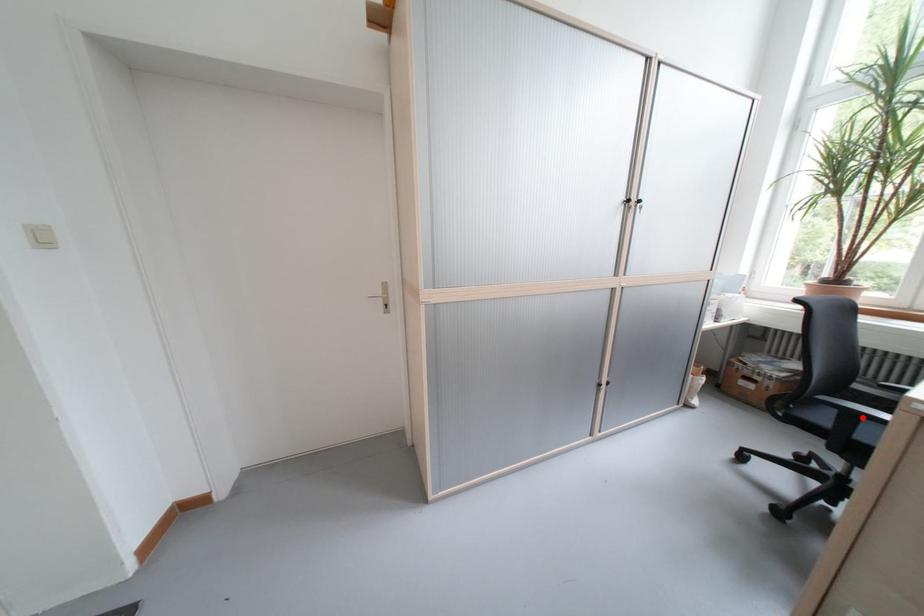
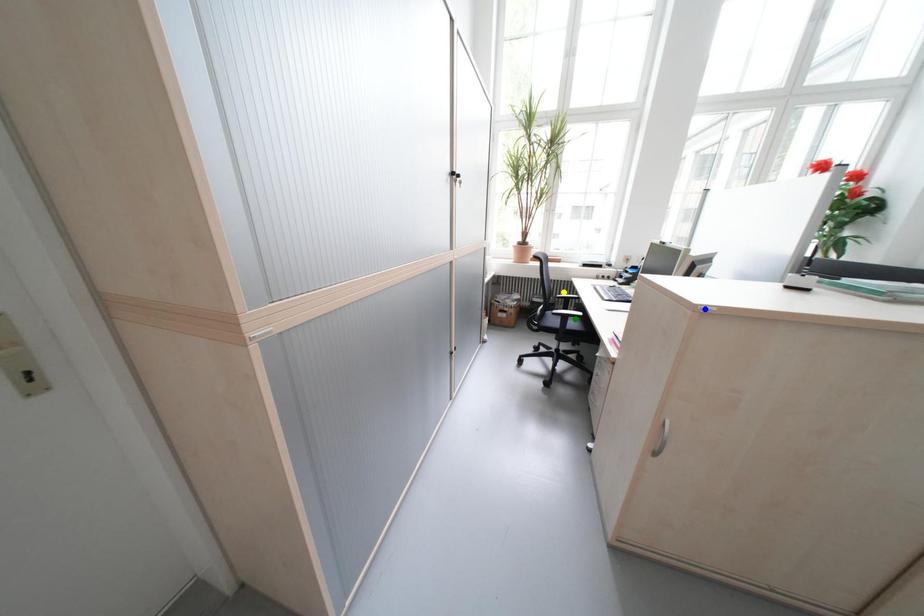
Question: I am providing you with two images of the same scene from different viewpoints. A red point is marked on the first image. You are given multiple points on the second image. Which point in image 2 represents the same 3d spot as the red point in image 1?

Choices:
 (A) green point
 (B) yellow point
 (C) blue point

Answer: (A)